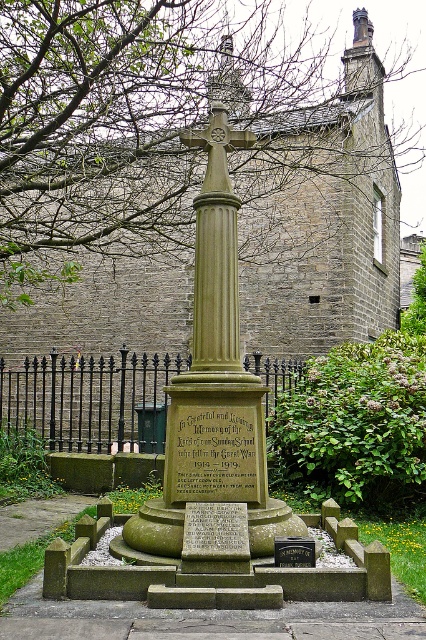
In the scene shown: Which of these two, smooth stone cross at center or black polished stone plaque at center, stands taller?

Standing taller between the two is smooth stone cross at center.

Who is positioned more to the right, smooth stone cross at center or black polished stone plaque at center?

Positioned to the right is black polished stone plaque at center.

Between point (201, 417) and point (282, 557), which one is positioned in front?

Point (282, 557)

Where is `smooth stone cross at center`? This screenshot has width=426, height=640. smooth stone cross at center is located at coordinates (213, 384).